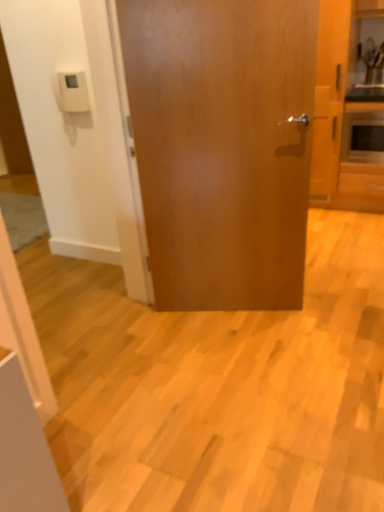
Image resolution: width=384 pixels, height=512 pixels. I want to click on free space in front of glossy wood door at center, so click(x=246, y=360).